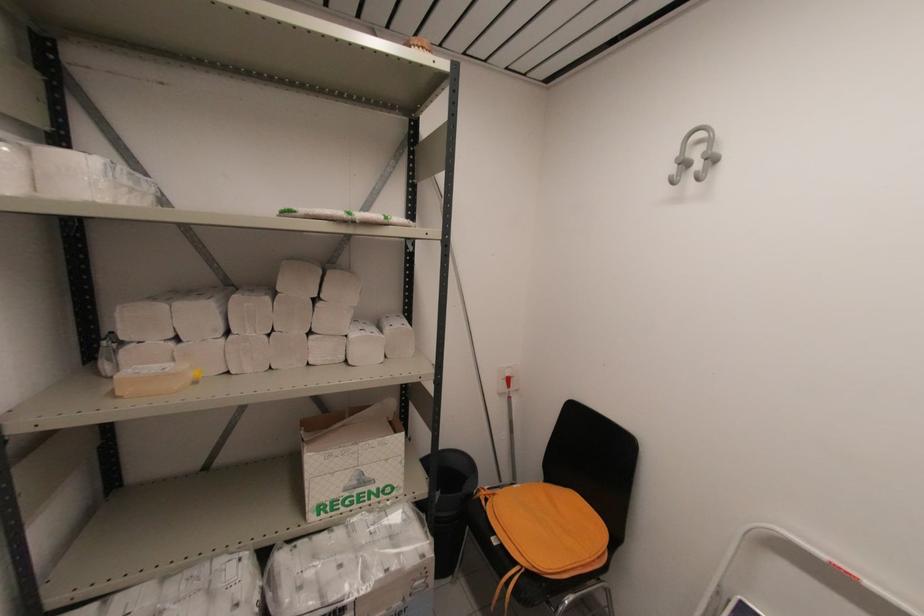
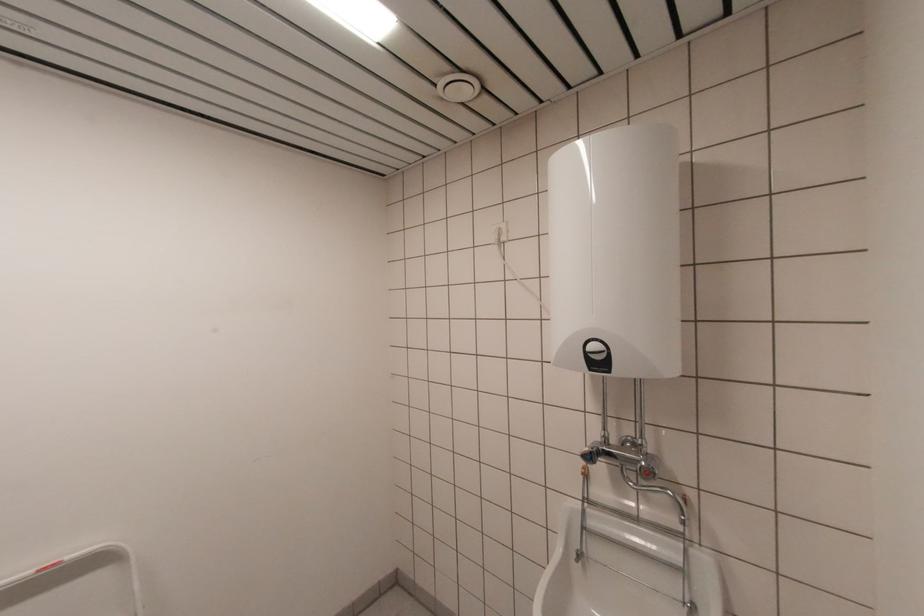
Question: The camera is either moving clockwise (left) or counter-clockwise (right) around the object. The first image is from the beginning of the video and the second image is from the end. Is the camera moving left or right when shooting the video?

Choices:
 (A) Left
 (B) Right

Answer: (A)